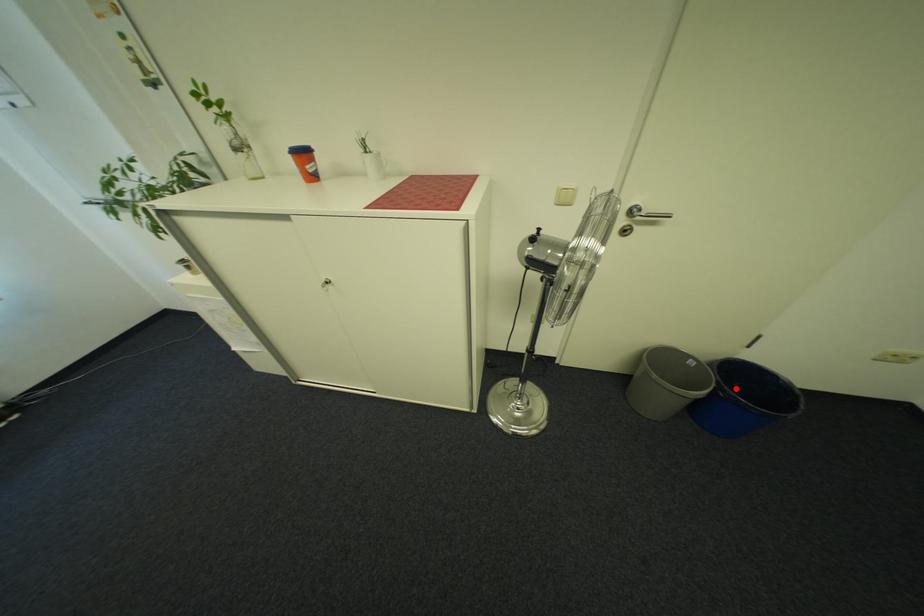
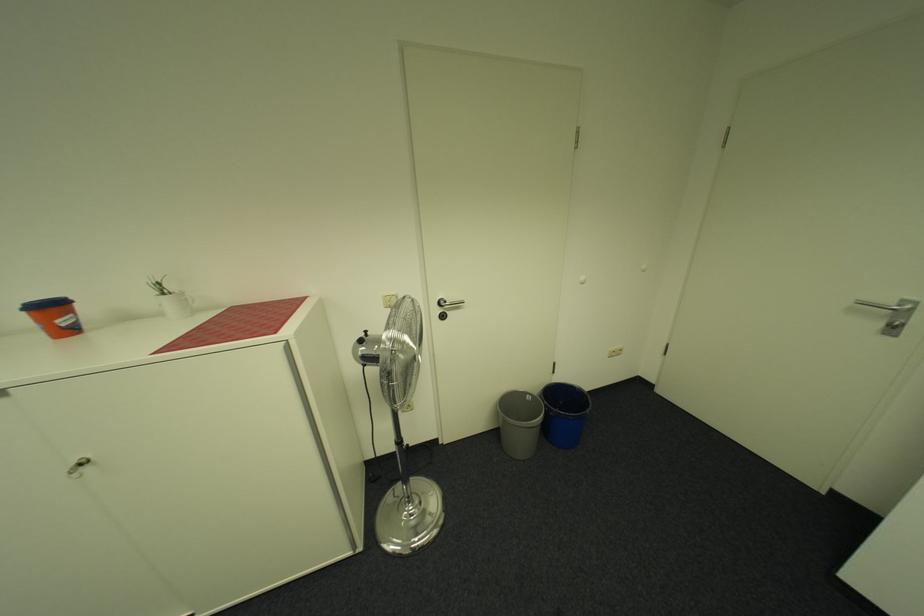
The point at the highlighted location is marked in the first image. Where is the corresponding point in the second image?

(562, 408)